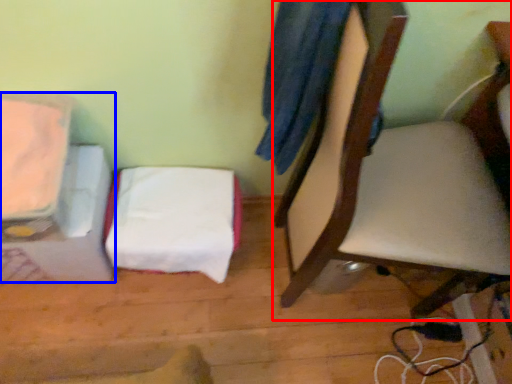
Question: Which object is further to the camera taking this photo, chair (highlighted by a red box) or furniture (highlighted by a blue box)?

Choices:
 (A) chair
 (B) furniture

Answer: (B)